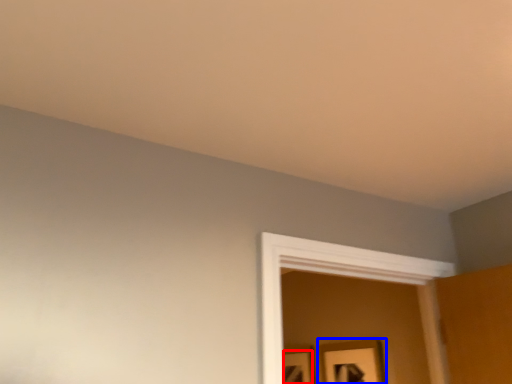
Question: Which object appears farthest to the camera in this image, picture frame (highlighted by a red box) or picture frame (highlighted by a blue box)?

Choices:
 (A) picture frame
 (B) picture frame

Answer: (A)